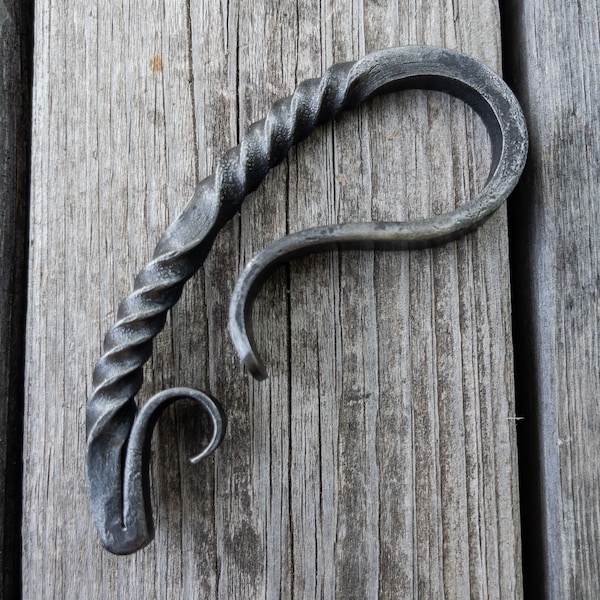
Image resolution: width=600 pixels, height=600 pixels. Find the location of `wood boards`. wood boards is located at coordinates coord(391,437), coord(553,252), coord(5,110).